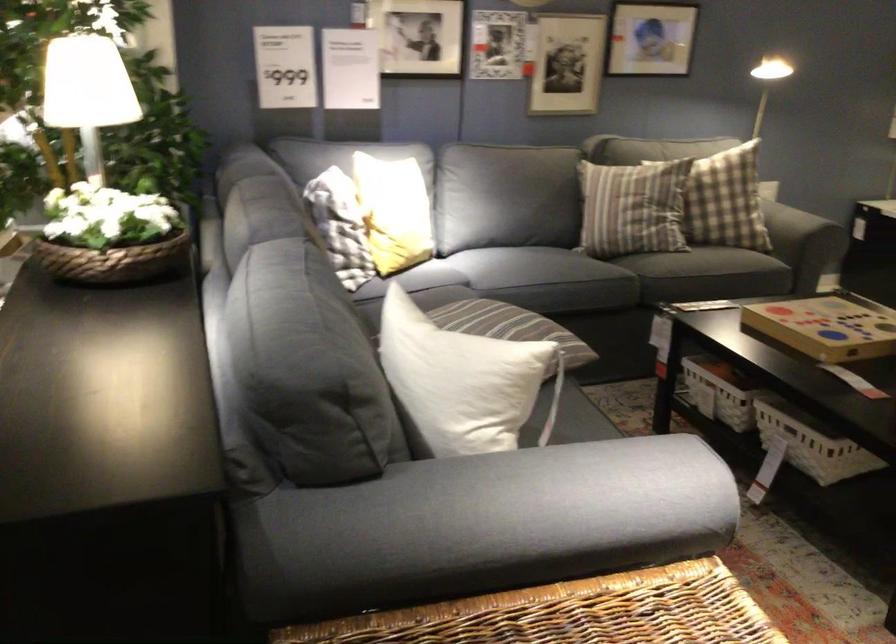
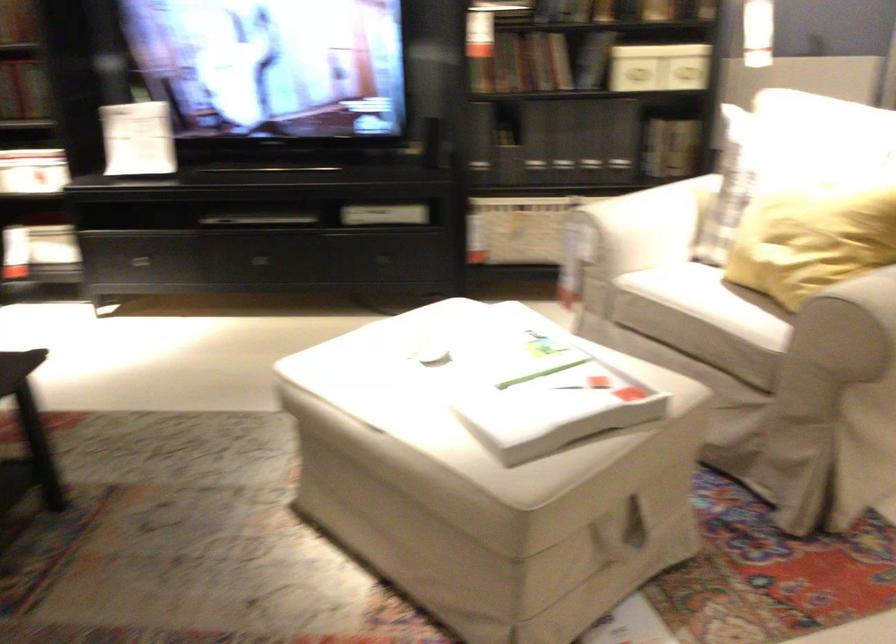
Question: The camera is either moving clockwise (left) or counter-clockwise (right) around the object. The first image is from the beginning of the video and the second image is from the end. Is the camera moving left or right when shooting the video?

Choices:
 (A) Left
 (B) Right

Answer: (A)